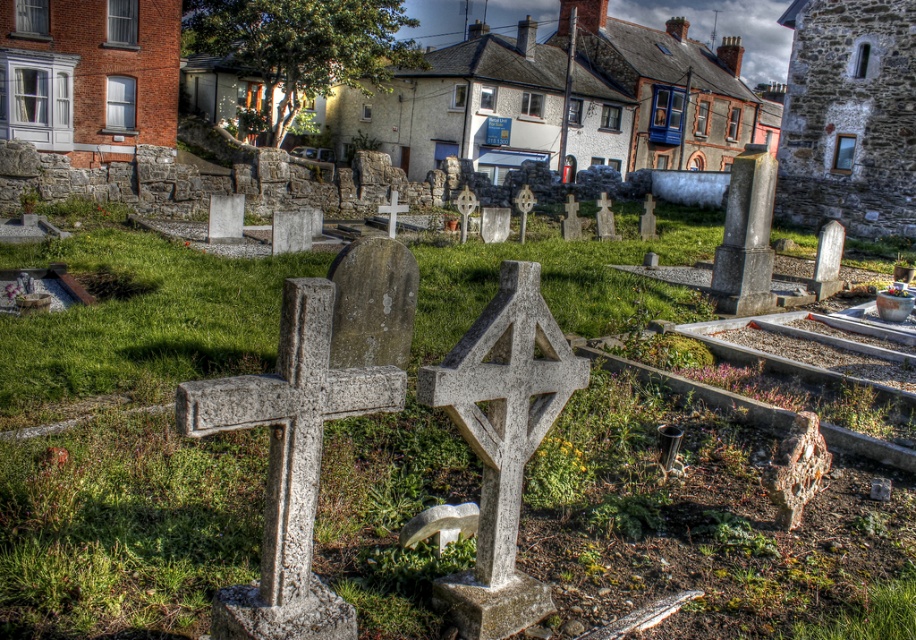
Question: Does white stone cross at center appear under smooth stone cross at center?

Choices:
 (A) yes
 (B) no

Answer: (A)

Question: Can you confirm if white stone cross at center is thinner than smooth stone cross at center?

Choices:
 (A) no
 (B) yes

Answer: (A)

Question: Does white stone cross at center appear under smooth stone cross at center?

Choices:
 (A) yes
 (B) no

Answer: (A)

Question: Which of the following is the farthest from the observer?

Choices:
 (A) smooth stone cross at center
 (B) white stone cross at center

Answer: (A)